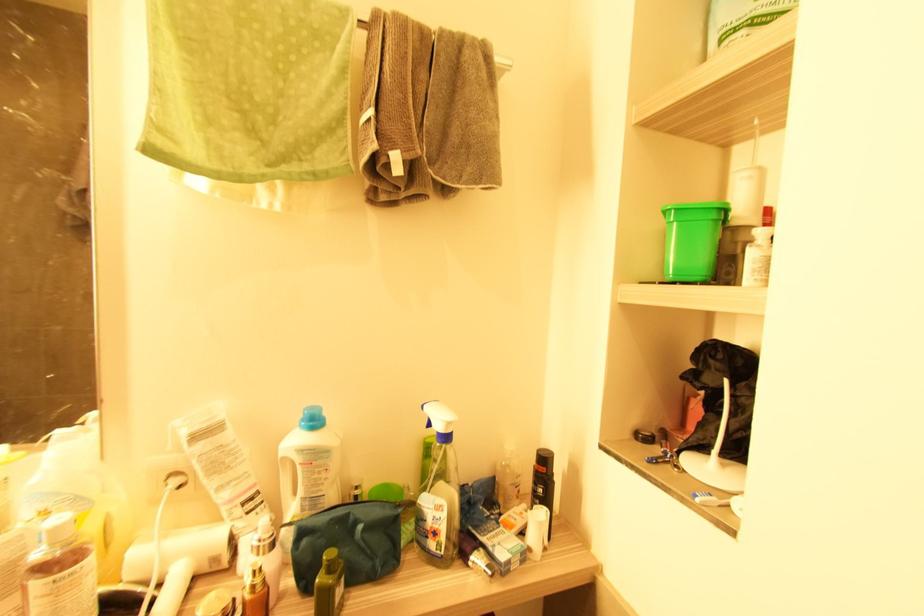
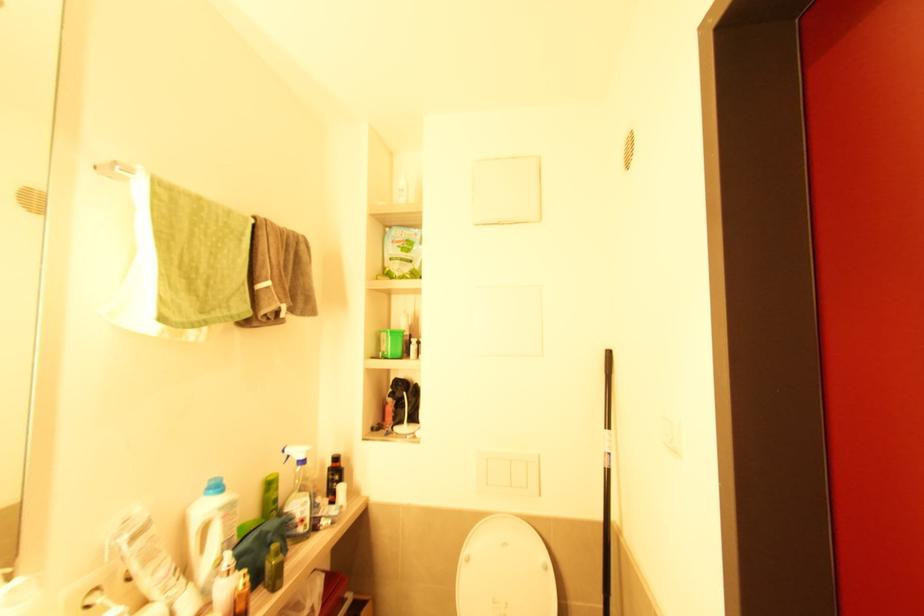
Where in the second image is the point corresponding to (x=429, y=539) from the first image?

(298, 527)